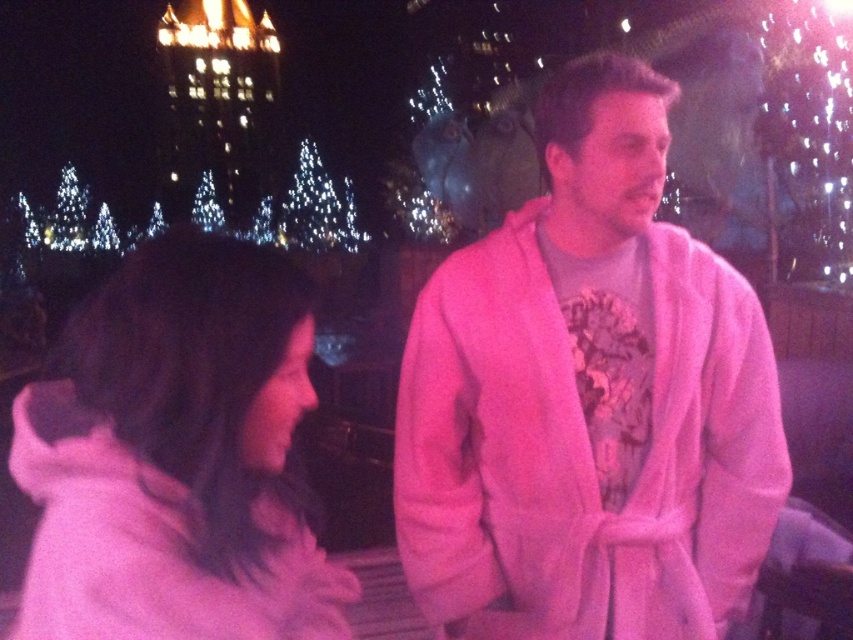
Question: Where is pink fleece robe at center located in relation to white fluffy coat at left in the image?

Choices:
 (A) below
 (B) above

Answer: (A)

Question: Can you confirm if pink fleece robe at center is bigger than white fluffy coat at left?

Choices:
 (A) yes
 (B) no

Answer: (B)

Question: Which of the following is the farthest from the observer?

Choices:
 (A) (744, 348)
 (B) (97, 340)

Answer: (A)

Question: Which object is closer to the camera taking this photo?

Choices:
 (A) white fluffy coat at left
 (B) pink fleece robe at center

Answer: (A)

Question: Is pink fleece robe at center bigger than white fluffy coat at left?

Choices:
 (A) yes
 (B) no

Answer: (B)